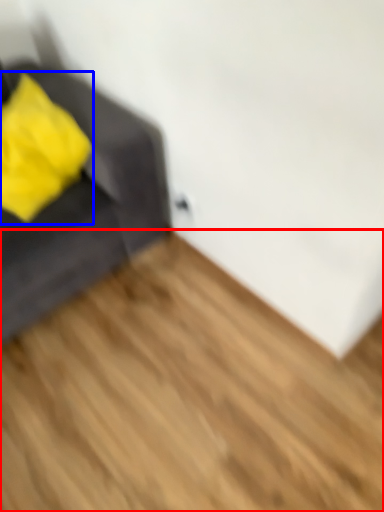
Question: Which of the following is the closest to the observer, hardwood (highlighted by a red box) or throw pillow (highlighted by a blue box)?

Choices:
 (A) hardwood
 (B) throw pillow

Answer: (A)